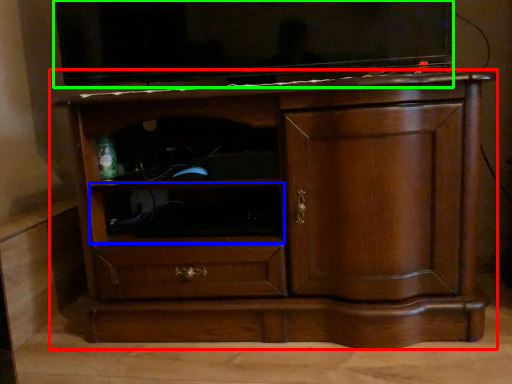
Question: Which object is positioned closest to chest of drawers (highlighted by a red box)? Select from shelf (highlighted by a blue box) and television (highlighted by a green box).

Choices:
 (A) shelf
 (B) television

Answer: (A)